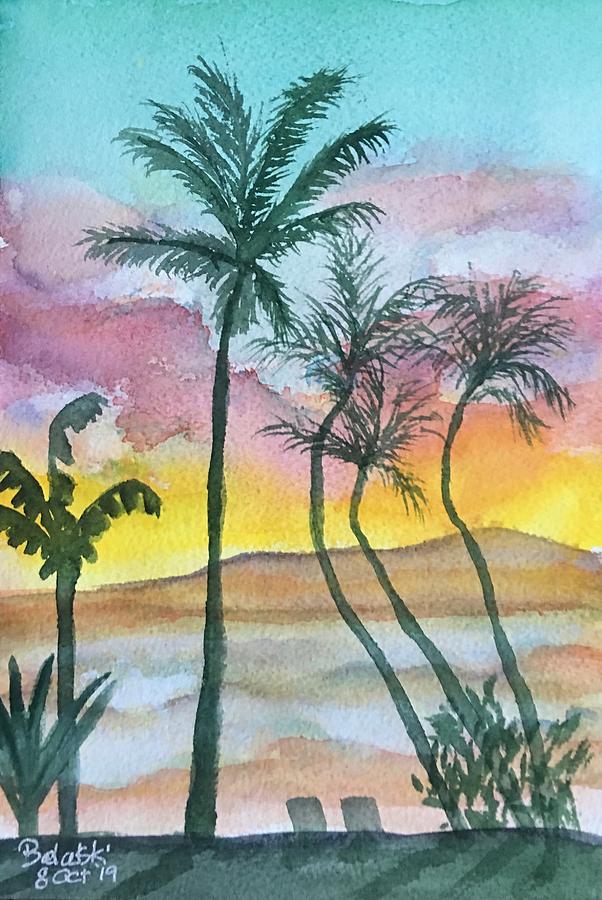
Locate an element on the screen. The height and width of the screenshot is (900, 602). chairs is located at coordinates click(303, 814), click(367, 814).